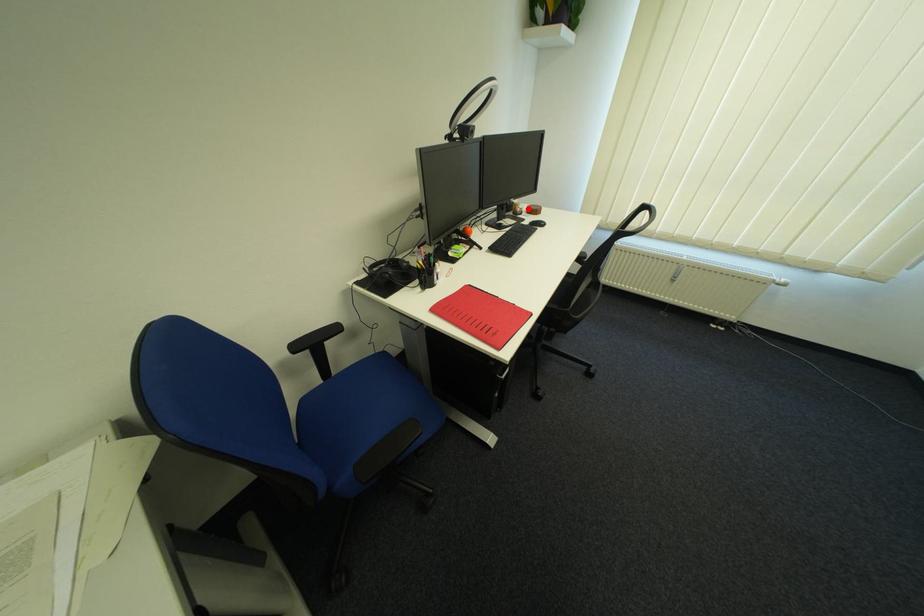
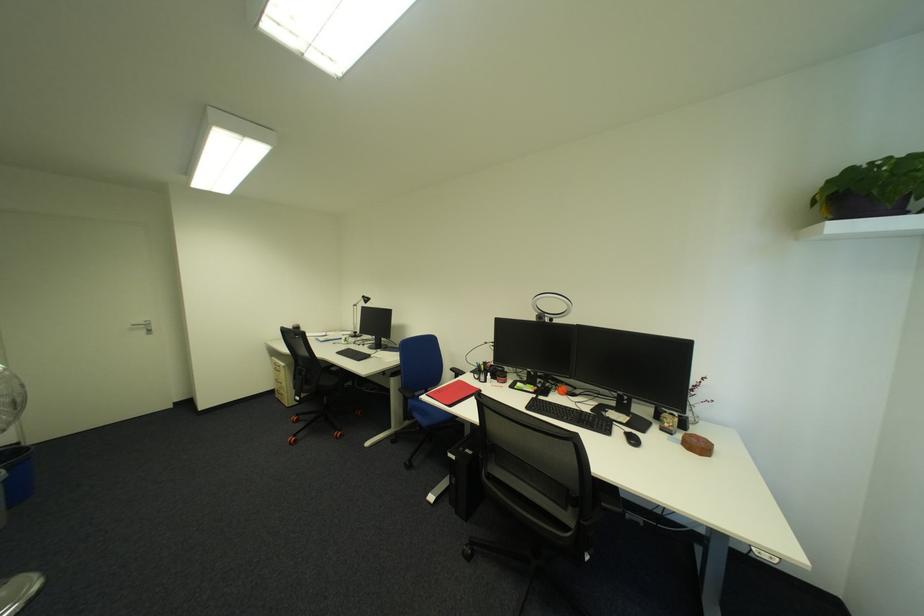
Where in the second image is the point corresponding to the highlighted location from the first image?

(677, 424)